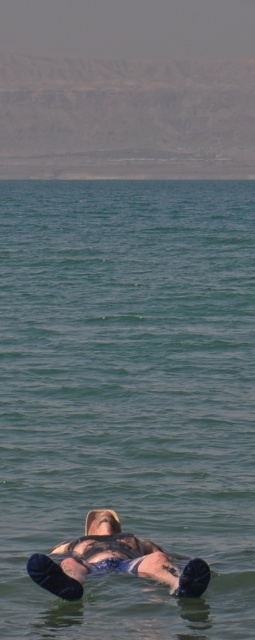
Between point (28, 540) and point (183, 572), which one is positioned in front?

Point (183, 572)

Between green liquid water at center and blue fabric person at center, which one is positioned higher?

green liquid water at center is higher up.

Which is behind, point (123, 384) or point (98, 522)?

Positioned behind is point (123, 384).

Where is `green liquid water at center`? The height and width of the screenshot is (640, 255). green liquid water at center is located at coordinates pos(128,396).